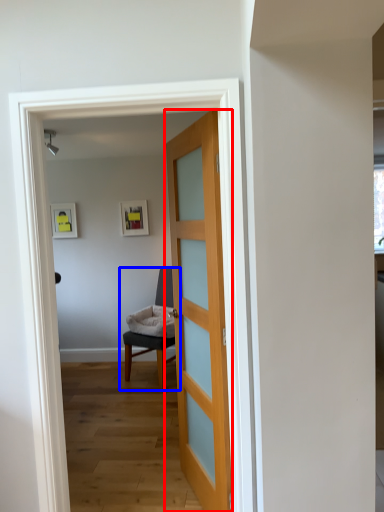
Question: Which object appears closest to the camera in this image, door (highlighted by a red box) or chair (highlighted by a blue box)?

Choices:
 (A) door
 (B) chair

Answer: (A)